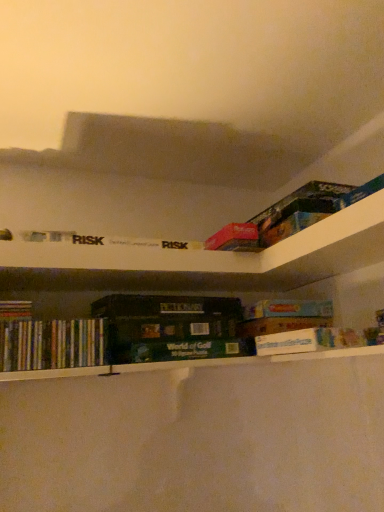
Question: Based on their sizes in the image, would you say multicolored paperbacks at lower left, which is counted as the first book, starting from the left, is bigger or smaller than hardcover dictionary at center?

Choices:
 (A) small
 (B) big

Answer: (A)

Question: Which is correct: multicolored paperbacks at lower left, which is counted as the first book, starting from the left, is inside hardcover dictionary at center, or outside of it?

Choices:
 (A) inside
 (B) outside

Answer: (B)

Question: Estimate the real-world distances between objects in this image. Which object is farther from the white cardboard box at center, which appears as the first book when viewed from the right?

Choices:
 (A) multicolored paperbacks at lower left, the second book when ordered from right to left
 (B) hardcover dictionary at center

Answer: (A)

Question: Estimate the real-world distances between objects in this image. Which object is closer to the multicolored paperbacks at lower left, which is counted as the first book, starting from the left?

Choices:
 (A) white cardboard box at center, which appears as the first book when viewed from the right
 (B) hardcover dictionary at center

Answer: (B)